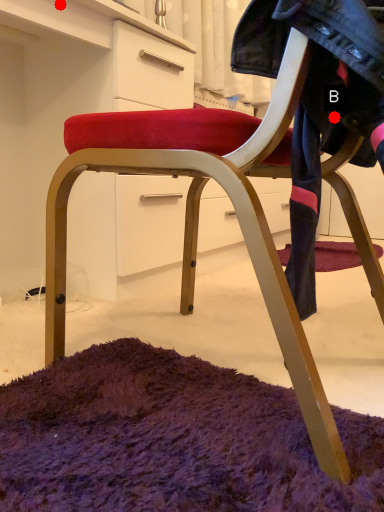
Question: Two points are circled on the image, labeled by A and B beside each circle. Which point is closer to the camera?

Choices:
 (A) A is closer
 (B) B is closer

Answer: (B)